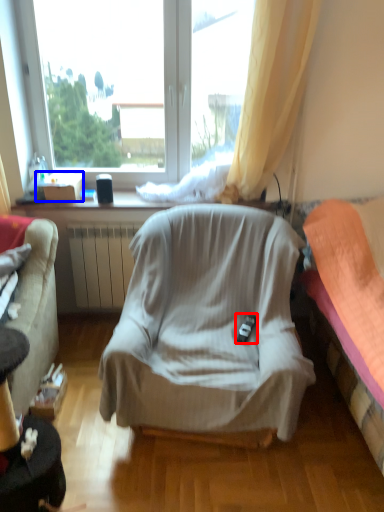
Question: Which of the following is the closest to the observer, remote control (highlighted by a red box) or box (highlighted by a blue box)?

Choices:
 (A) remote control
 (B) box

Answer: (A)